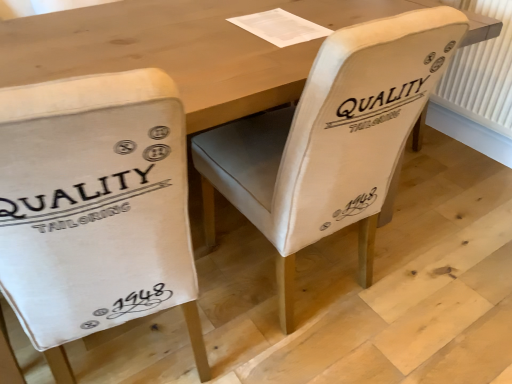
Question: Does white fabric chair at center, the 2th chair from the left, have a lesser height compared to white canvas chair at left, acting as the first chair starting from the left?

Choices:
 (A) no
 (B) yes

Answer: (A)

Question: Is white fabric chair at center, the 2th chair from the left, next to white canvas chair at left, acting as the first chair starting from the left?

Choices:
 (A) no
 (B) yes

Answer: (A)

Question: From the image's perspective, is white fabric chair at center, which appears as the first chair when viewed from the right, beneath white canvas chair at left, acting as the first chair starting from the left?

Choices:
 (A) yes
 (B) no

Answer: (B)

Question: Is white fabric chair at center, which appears as the first chair when viewed from the right, far away from white canvas chair at left, which ranks as the 2th chair in right-to-left order?

Choices:
 (A) no
 (B) yes

Answer: (A)

Question: Is white fabric chair at center, the 2th chair from the left, to the left of white canvas chair at left, acting as the first chair starting from the left, from the viewer's perspective?

Choices:
 (A) no
 (B) yes

Answer: (A)

Question: From a real-world perspective, is white fabric chair at center, the 2th chair from the left, above or below white plastic radiator at right?

Choices:
 (A) above
 (B) below

Answer: (A)

Question: Is point (370, 44) positioned closer to the camera than point (494, 114)?

Choices:
 (A) closer
 (B) farther

Answer: (A)

Question: From their relative heights in the image, would you say white fabric chair at center, which appears as the first chair when viewed from the right, is taller or shorter than white plastic radiator at right?

Choices:
 (A) short
 (B) tall

Answer: (B)

Question: Which is correct: white fabric chair at center, the 2th chair from the left, is inside white plastic radiator at right, or outside of it?

Choices:
 (A) inside
 (B) outside

Answer: (B)

Question: Considering the positions of white canvas chair at left, which ranks as the 2th chair in right-to-left order, and white plastic radiator at right in the image, is white canvas chair at left, which ranks as the 2th chair in right-to-left order, wider or thinner than white plastic radiator at right?

Choices:
 (A) thin
 (B) wide

Answer: (B)

Question: Is white canvas chair at left, which ranks as the 2th chair in right-to-left order, in front of or behind white plastic radiator at right in the image?

Choices:
 (A) front
 (B) behind

Answer: (A)

Question: In terms of height, does white canvas chair at left, which ranks as the 2th chair in right-to-left order, look taller or shorter compared to white plastic radiator at right?

Choices:
 (A) short
 (B) tall

Answer: (B)

Question: Do you think white canvas chair at left, acting as the first chair starting from the left, is within white plastic radiator at right, or outside of it?

Choices:
 (A) outside
 (B) inside

Answer: (A)

Question: Based on their positions, is white plastic radiator at right located to the left or right of white canvas chair at left, which ranks as the 2th chair in right-to-left order?

Choices:
 (A) right
 (B) left

Answer: (A)

Question: From the image's perspective, is white plastic radiator at right positioned above or below white canvas chair at left, acting as the first chair starting from the left?

Choices:
 (A) below
 (B) above

Answer: (B)